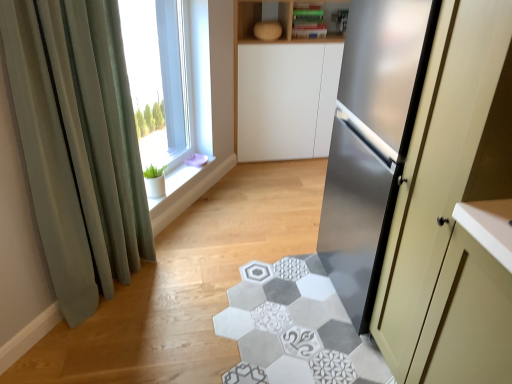
Question: Is satin silver refrigerator at right turned away from clear glass window at upper left?

Choices:
 (A) yes
 (B) no

Answer: (B)

Question: Are satin silver refrigerator at right and clear glass window at upper left beside each other?

Choices:
 (A) no
 (B) yes

Answer: (A)

Question: Does satin silver refrigerator at right contain clear glass window at upper left?

Choices:
 (A) yes
 (B) no

Answer: (B)

Question: Is satin silver refrigerator at right positioned in front of clear glass window at upper left?

Choices:
 (A) no
 (B) yes

Answer: (B)

Question: Are satin silver refrigerator at right and clear glass window at upper left far apart?

Choices:
 (A) no
 (B) yes

Answer: (B)

Question: From the image's perspective, is clear glass window at upper left located above or below green fabric curtain at left?

Choices:
 (A) above
 (B) below

Answer: (A)

Question: Would you say clear glass window at upper left is inside or outside green fabric curtain at left?

Choices:
 (A) outside
 (B) inside

Answer: (A)

Question: Considering the positions of clear glass window at upper left and green fabric curtain at left in the image, is clear glass window at upper left wider or thinner than green fabric curtain at left?

Choices:
 (A) wide
 (B) thin

Answer: (B)

Question: Considering the positions of point (147, 6) and point (61, 221), is point (147, 6) closer or farther from the camera than point (61, 221)?

Choices:
 (A) farther
 (B) closer

Answer: (A)

Question: Considering the positions of green fabric curtain at left and satin silver refrigerator at right in the image, is green fabric curtain at left taller or shorter than satin silver refrigerator at right?

Choices:
 (A) short
 (B) tall

Answer: (A)

Question: Is green fabric curtain at left inside the boundaries of satin silver refrigerator at right, or outside?

Choices:
 (A) outside
 (B) inside

Answer: (A)

Question: Is green fabric curtain at left in front of or behind satin silver refrigerator at right in the image?

Choices:
 (A) front
 (B) behind

Answer: (B)

Question: Does point (22, 38) appear closer or farther from the camera than point (378, 307)?

Choices:
 (A) closer
 (B) farther

Answer: (A)

Question: From the image's perspective, is green fabric curtain at left above or below white ceramic window sill at upper left?

Choices:
 (A) above
 (B) below

Answer: (A)

Question: Based on their positions, is green fabric curtain at left located to the left or right of white ceramic window sill at upper left?

Choices:
 (A) left
 (B) right

Answer: (A)